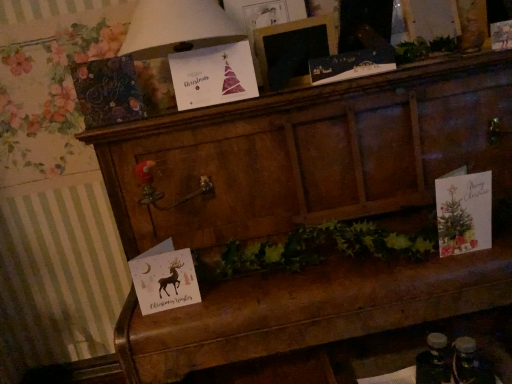
Question: In the image, is matte paper card at right, which is counted as the fourth christmas card, starting from the left, positioned in front of or behind matte white card with reindeer at lower left, marked as the 1th christmas card in a left-to-right arrangement?

Choices:
 (A) front
 (B) behind

Answer: (A)

Question: From their relative heights in the image, would you say matte paper card at right, which is counted as the fourth christmas card, starting from the left, is taller or shorter than matte white card with reindeer at lower left, marked as the 1th christmas card in a left-to-right arrangement?

Choices:
 (A) short
 (B) tall

Answer: (B)

Question: Which object is the farthest from the matte black card at upper center, the first christmas card from the top?

Choices:
 (A) wooden picture frame at upper center
 (B) white paper christmas card at upper center
 (C) matte paper card at right, positioned as the 3th christmas card in top-to-bottom order
 (D) matte white card with reindeer at lower left, which ranks as the fourth christmas card in right-to-left order
 (E) watercolor paper christmas card at upper center, acting as the 3th christmas card starting from the bottom

Answer: (D)

Question: Which object is positioned closest to the white paper christmas card at upper center?

Choices:
 (A) wooden picture frame at upper center
 (B) matte paper card at right, which is counted as the fourth christmas card, starting from the left
 (C) watercolor paper christmas card at upper center, arranged as the 3th christmas card when viewed from the right
 (D) wooden chest at center
 (E) matte black card at upper center, the 2th christmas card viewed from the right

Answer: (C)